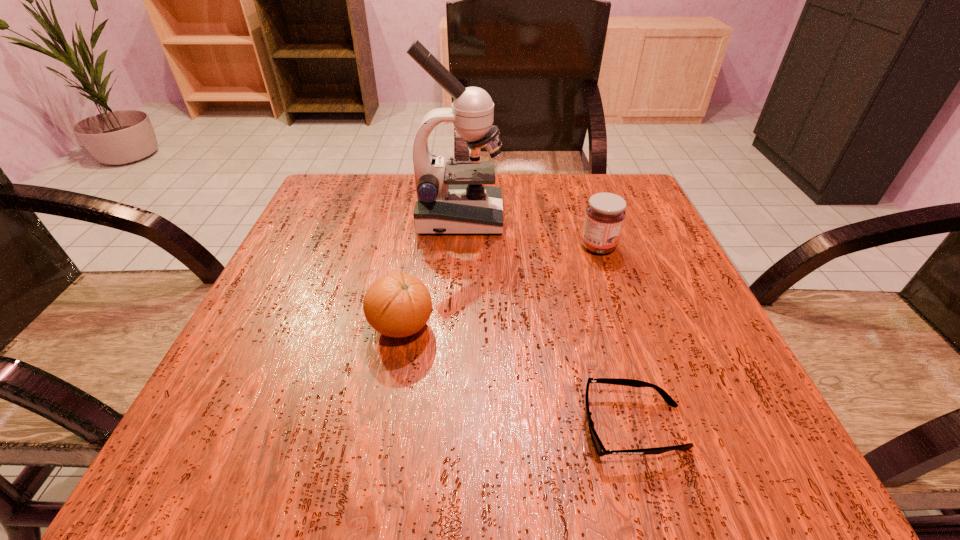
I want to click on vacant region between the tallest object and the jam, so click(x=529, y=232).

In order to click on free space between the nearest object and the orange in this screenshot , I will do `click(518, 377)`.

At what (x,y) coordinates should I click in order to perform the action: click on free space between the microscope and the sunglasses. Please return your answer as a coordinate pair (x, y). The width and height of the screenshot is (960, 540). Looking at the image, I should click on (547, 322).

Locate an element on the screen. free space between the jam and the second nearest object is located at coordinates click(x=500, y=287).

This screenshot has width=960, height=540. In order to click on object that is the second closest to the tallest object in this screenshot , I will do `click(397, 305)`.

The width and height of the screenshot is (960, 540). I want to click on object that ranks as the second closest to the jam, so click(397, 305).

Locate an element on the screen. Image resolution: width=960 pixels, height=540 pixels. vacant region that satisfies the following two spatial constraints: 1. on the back side of the third farthest object; 2. on the right side of the tallest object is located at coordinates (421, 218).